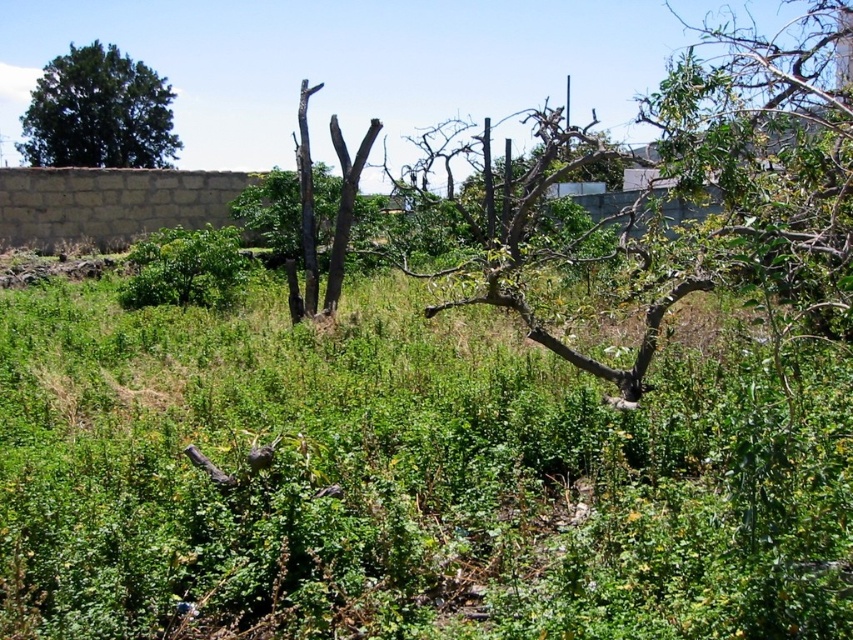
You are standing in the neglected garden scene. You see two points marked in the image. Which point is closer to you, point (x=35, y=132) or point (x=222, y=228)?

Point (x=35, y=132) is further to the camera than point (x=222, y=228), so point (x=222, y=228) is closer to you.

You are planning to plant a new tree in this garden. The dark green leafy tree at upper left and the green leafy bush at center are already present. Which existing plant should you consider for spacing due to its size when deciding where to place the new tree?

The dark green leafy tree at upper left should be considered for spacing due to its larger size compared to the green leafy bush at center.